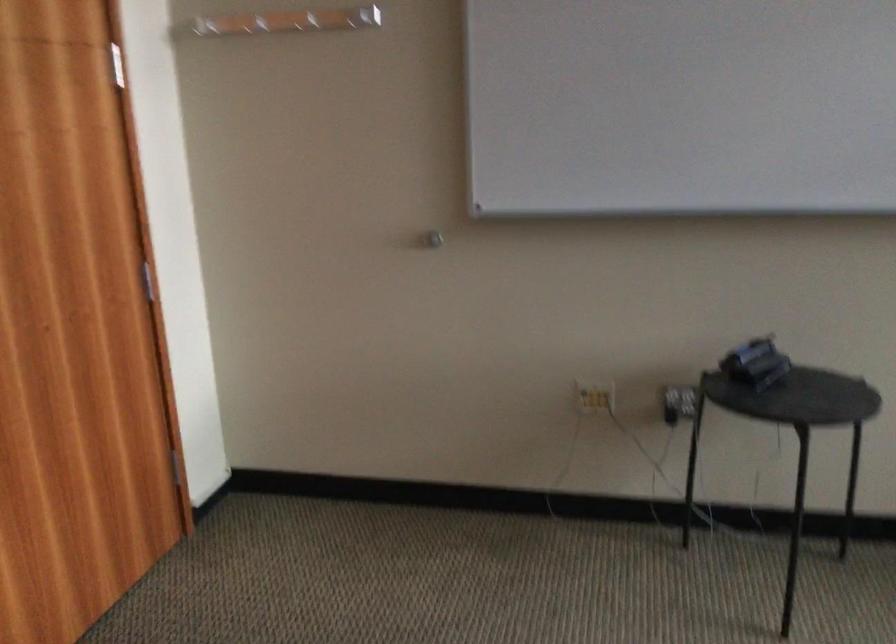
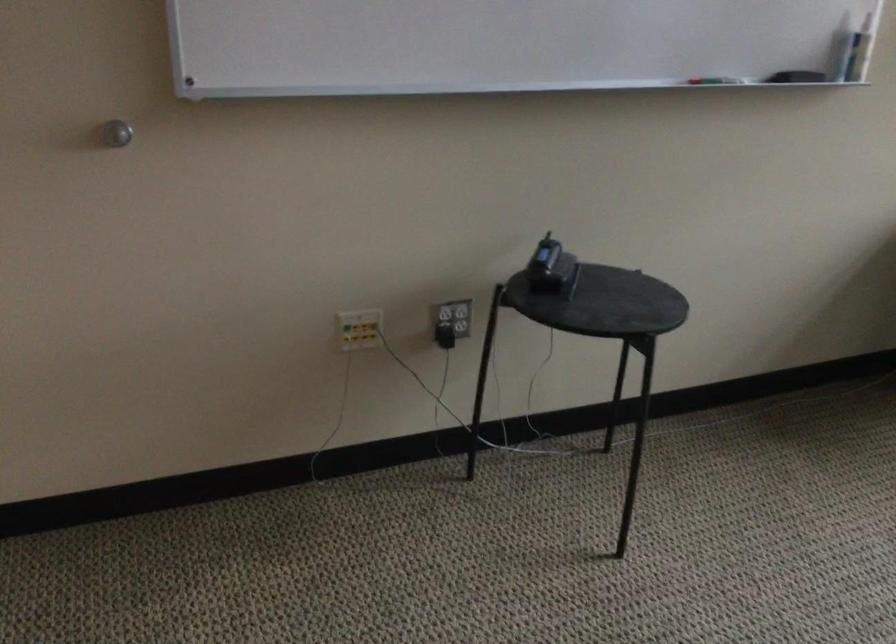
Question: Based on the continuous images, in which direction is the camera rotating? Reply with the corresponding letter.

Choices:
 (A) Left
 (B) Right
 (C) Up
 (D) Down

Answer: (B)